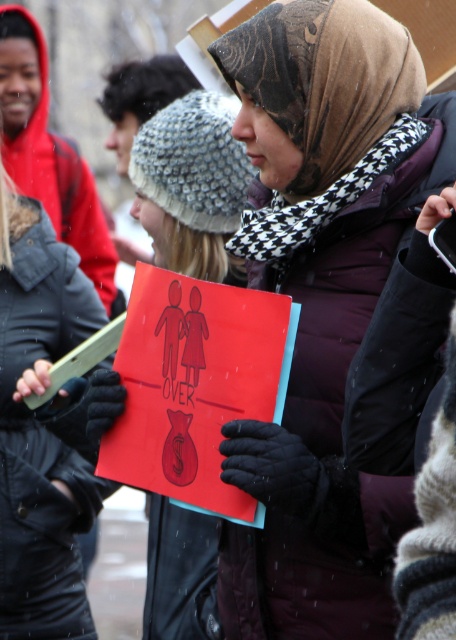
Is matte purple jacket at center shorter than matte black jacket at left?

Yes, matte purple jacket at center is shorter than matte black jacket at left.

What do you see at coordinates (321, 304) in the screenshot? The image size is (456, 640). I see `matte purple jacket at center` at bounding box center [321, 304].

This screenshot has height=640, width=456. Find the location of `matte purple jacket at center`. matte purple jacket at center is located at coordinates (321, 304).